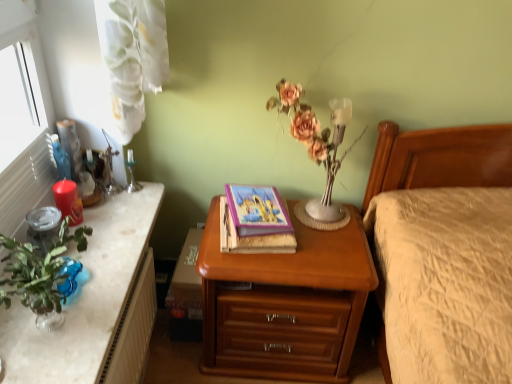
Question: Is white textured radiator at lower left far from matte pink flowers at center?

Choices:
 (A) no
 (B) yes

Answer: (A)

Question: Is white textured radiator at lower left bigger than matte pink flowers at center?

Choices:
 (A) yes
 (B) no

Answer: (B)

Question: From a real-world perspective, is white textured radiator at lower left below matte pink flowers at center?

Choices:
 (A) yes
 (B) no

Answer: (A)

Question: Is matte pink flowers at center inside white textured radiator at lower left?

Choices:
 (A) no
 (B) yes

Answer: (A)

Question: Is white textured radiator at lower left positioned before matte pink flowers at center?

Choices:
 (A) yes
 (B) no

Answer: (A)

Question: From their relative heights in the image, would you say green marble desk at left is taller or shorter than matte pink flowers at center?

Choices:
 (A) tall
 (B) short

Answer: (B)

Question: Is green marble desk at left to the left or to the right of matte pink flowers at center in the image?

Choices:
 (A) right
 (B) left

Answer: (B)

Question: From the image's perspective, relative to matte pink flowers at center, is green marble desk at left above or below?

Choices:
 (A) above
 (B) below

Answer: (B)

Question: Is green marble desk at left inside or outside of matte pink flowers at center?

Choices:
 (A) inside
 (B) outside

Answer: (B)

Question: Does point (123, 192) appear closer or farther from the camera than point (56, 200)?

Choices:
 (A) farther
 (B) closer

Answer: (A)

Question: From their relative heights in the image, would you say green marble desk at left is taller or shorter than matte red candle at left?

Choices:
 (A) short
 (B) tall

Answer: (A)

Question: From the image's perspective, is green marble desk at left positioned above or below matte red candle at left?

Choices:
 (A) above
 (B) below

Answer: (B)

Question: From a real-world perspective, is green marble desk at left positioned above or below matte red candle at left?

Choices:
 (A) above
 (B) below

Answer: (B)

Question: From a real-world perspective, is silver metallic candle holder at upper left positioned above or below green marble desk at left?

Choices:
 (A) above
 (B) below

Answer: (A)

Question: Is silver metallic candle holder at upper left wider or thinner than green marble desk at left?

Choices:
 (A) wide
 (B) thin

Answer: (B)